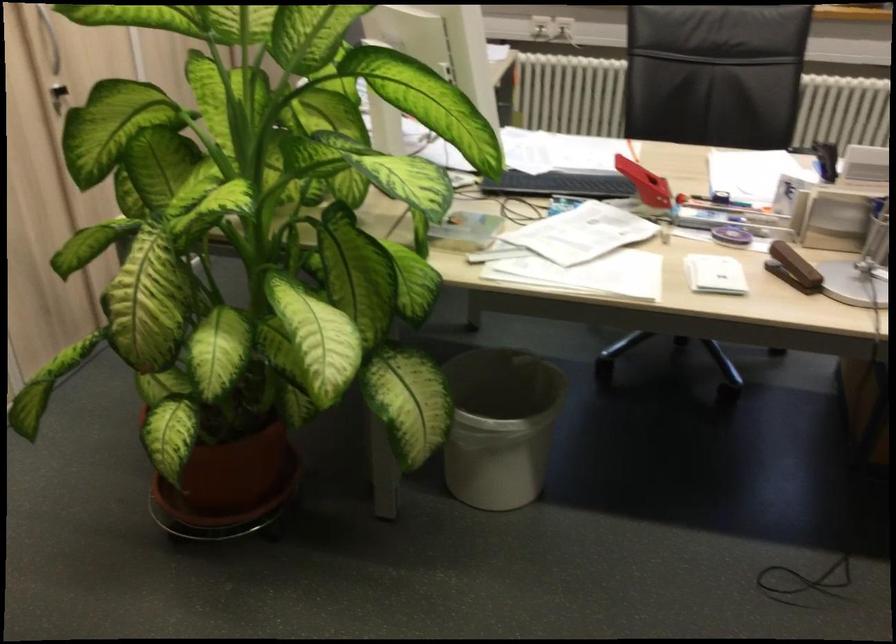
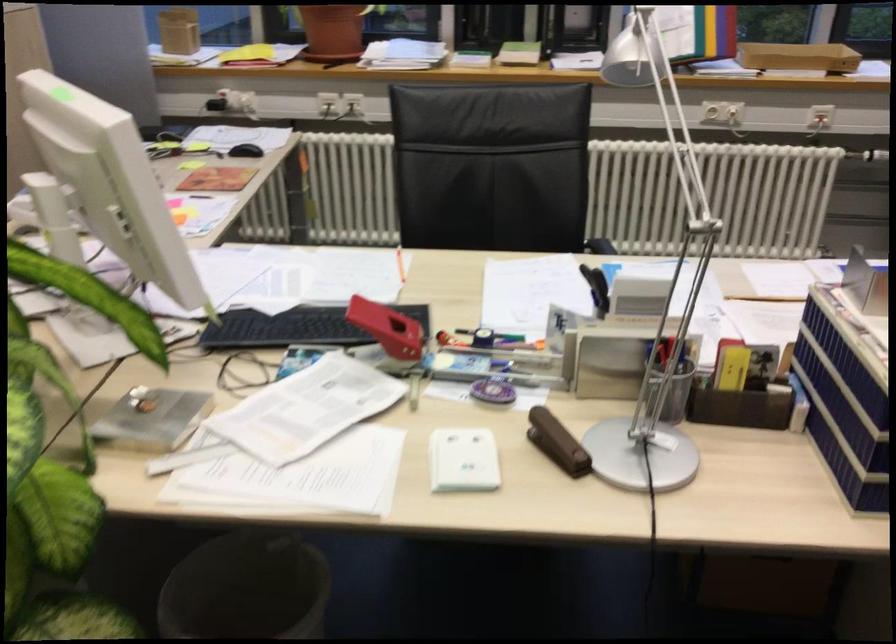
Find the pixel in the second image that matches (x=642, y=180) in the first image.

(388, 328)